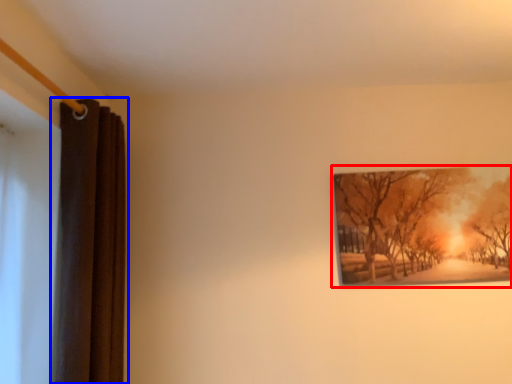
Question: Among these objects, which one is farthest to the camera, picture frame (highlighted by a red box) or curtain (highlighted by a blue box)?

Choices:
 (A) picture frame
 (B) curtain

Answer: (A)